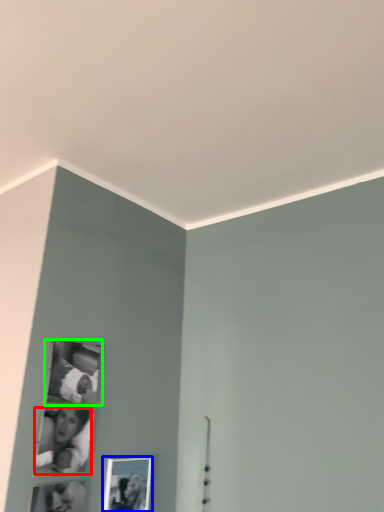
Question: Which is farther away from couple (highlighted by a red box)? picture frame (highlighted by a blue box) or picture frame (highlighted by a green box)?

Choices:
 (A) picture frame
 (B) picture frame

Answer: (A)